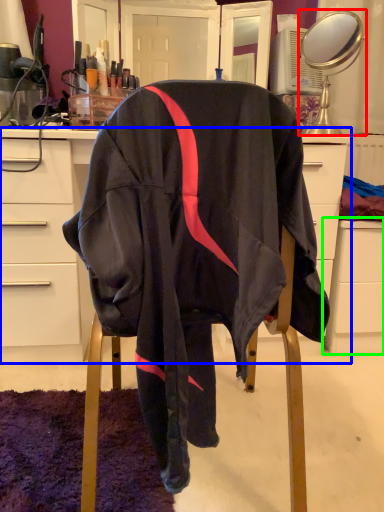
Question: Which object is the closest to the mirror (highlighted by a red box)? Choose among these: desk (highlighted by a blue box) or file cabinet (highlighted by a green box).

Choices:
 (A) desk
 (B) file cabinet

Answer: (B)